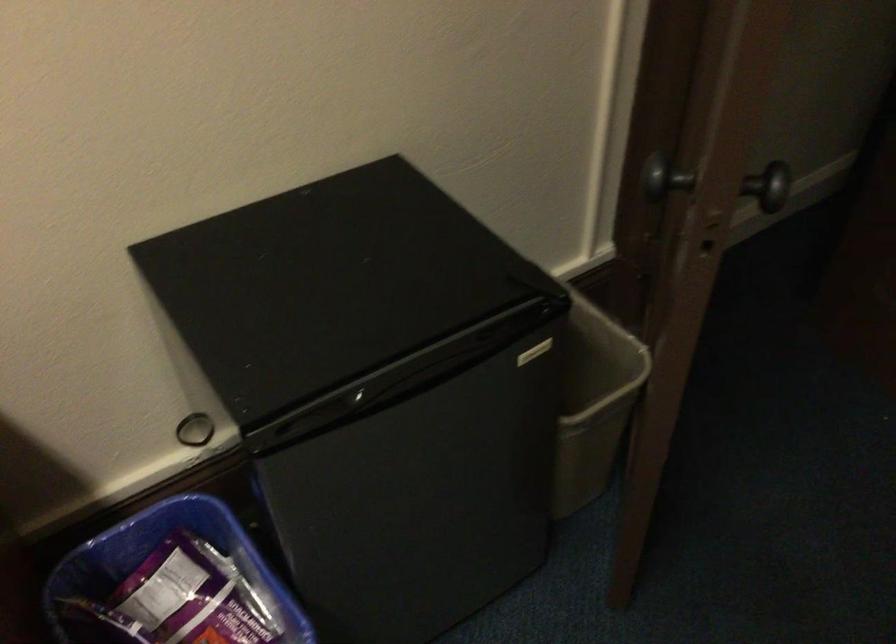
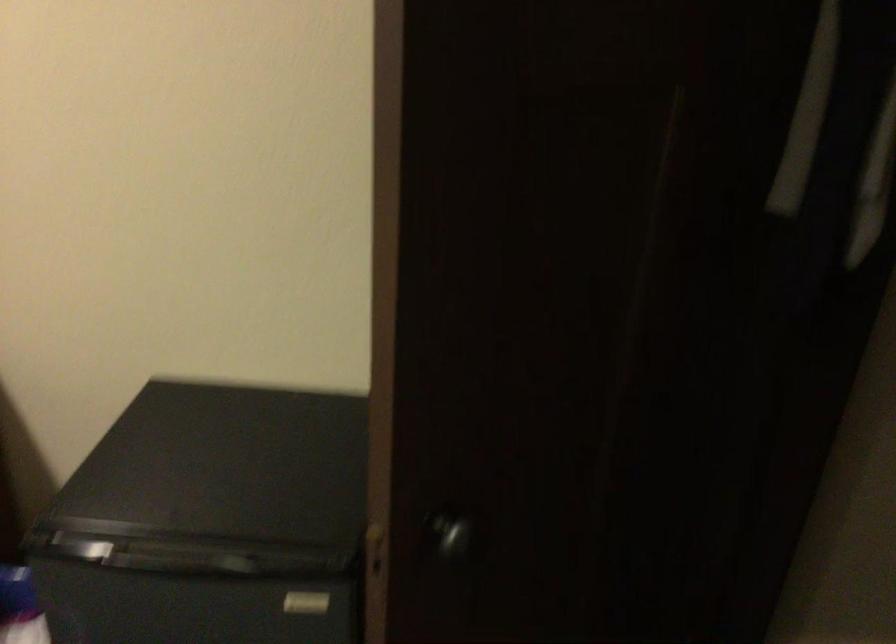
Find the pixel in the second image that matches [769,194] in the first image.

(451, 535)